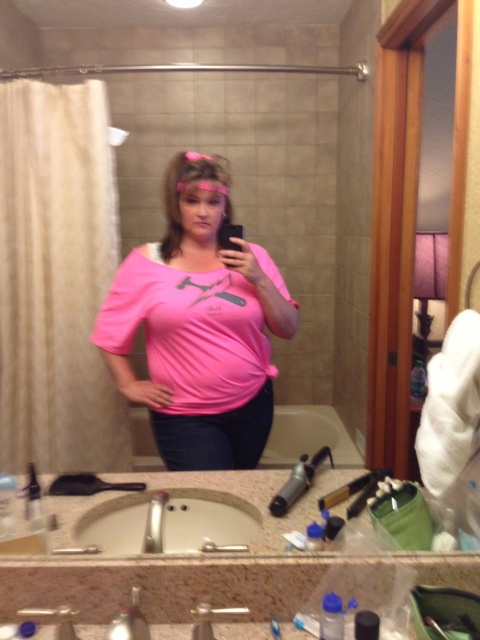
Which is more to the left, pink matte shirt at center or black plastic brush at lower left?

black plastic brush at lower left is more to the left.

Is point (148, 333) farther from viewer compared to point (91, 481)?

That is True.

Is point (271, 300) positioned after point (63, 493)?

Yes, point (271, 300) is behind point (63, 493).

The image size is (480, 640). Find the location of `pink matte shirt at center`. pink matte shirt at center is located at coordinates (199, 326).

Can you confirm if pink matte shirt at center is thinner than white ceramic sink at lower center?

In fact, pink matte shirt at center might be wider than white ceramic sink at lower center.

Between pink matte shirt at center and white ceramic sink at lower center, which one appears on the left side from the viewer's perspective?

pink matte shirt at center is more to the left.

Does point (192, 288) lie behind point (106, 552)?

Yes.

Identify the location of pink matte shirt at center. The image size is (480, 640). (199, 326).

Locate an element on the screen. The image size is (480, 640). white ceramic sink at lower center is located at coordinates (168, 522).

Does point (189, 506) come closer to viewer compared to point (57, 486)?

That is False.

Identify the location of white ceramic sink at lower center. The height and width of the screenshot is (640, 480). (168, 522).